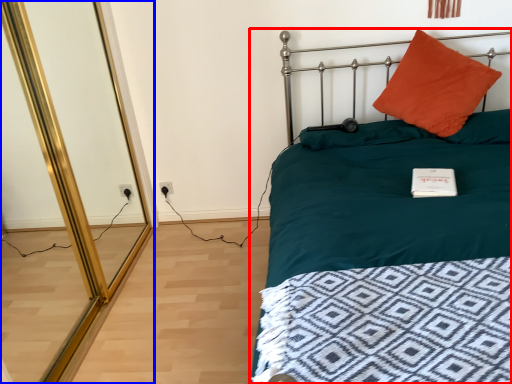
Question: Which object appears farthest to the camera in this image, bed (highlighted by a red box) or screen door (highlighted by a blue box)?

Choices:
 (A) bed
 (B) screen door

Answer: (B)